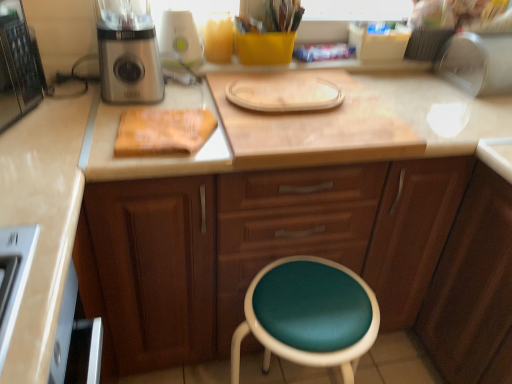
The image size is (512, 384). Describe the element at coordinates (309, 315) in the screenshot. I see `teal leather stool at lower center` at that location.

Where is `wooden cabinet at center`? This screenshot has height=384, width=512. wooden cabinet at center is located at coordinates (255, 248).

This screenshot has width=512, height=384. I want to click on white plastic blender at upper center, positioned as the 2th appliance in right-to-left order, so click(x=179, y=39).

What is the approximate width of satin silver blender at left?

It is 8.88 inches.

At what (x,y) coordinates should I click in order to perform the action: click on metallic silver appliance at upper right, the second appliance positioned from the left. Please return your answer as a coordinate pair (x, y). The image size is (512, 384). Looking at the image, I should click on (477, 63).

Where is `wooden cutting board at center`? Image resolution: width=512 pixels, height=384 pixels. wooden cutting board at center is located at coordinates (316, 130).

In order to click on teal leather stool at lower center in this screenshot , I will do `click(309, 315)`.

Is wooden cutting board at center next to teal leather stool at lower center?

No, wooden cutting board at center is not touching teal leather stool at lower center.

Considering the points (350, 107) and (234, 380), which point is behind, point (350, 107) or point (234, 380)?

The point (350, 107) is more distant.

Considering the positions of objects wooden cutting board at center and teal leather stool at lower center in the image provided, who is more to the right, wooden cutting board at center or teal leather stool at lower center?

wooden cutting board at center.

Between wooden cutting board at center and teal leather stool at lower center, which one has less height?

With less height is wooden cutting board at center.

Is teal leather stool at lower center bigger or smaller than white plastic blender at upper center, placed as the 1th appliance when sorted from left to right?

Considering their sizes, teal leather stool at lower center takes up more space than white plastic blender at upper center, placed as the 1th appliance when sorted from left to right.

Is teal leather stool at lower center situated inside white plastic blender at upper center, positioned as the 2th appliance in right-to-left order, or outside?

teal leather stool at lower center cannot be found inside white plastic blender at upper center, positioned as the 2th appliance in right-to-left order.

From a real-world perspective, is teal leather stool at lower center under white plastic blender at upper center, placed as the 1th appliance when sorted from left to right?

Yes, from a real-world perspective, teal leather stool at lower center is below white plastic blender at upper center, placed as the 1th appliance when sorted from left to right.

How different are the orientations of teal leather stool at lower center and white plastic blender at upper center, positioned as the 2th appliance in right-to-left order, in degrees?

teal leather stool at lower center and white plastic blender at upper center, positioned as the 2th appliance in right-to-left order, are facing 0.0428 degrees away from each other.

Considering the sizes of satin silver blender at left and wooden cutting board at center in the image, is satin silver blender at left wider or thinner than wooden cutting board at center?

Considering their sizes, satin silver blender at left looks slimmer than wooden cutting board at center.

Can you confirm if satin silver blender at left is shorter than wooden cutting board at center?

No, satin silver blender at left is not shorter than wooden cutting board at center.

Can wooden cutting board at center be found inside satin silver blender at left?

No, satin silver blender at left does not contain wooden cutting board at center.

Considering the relative sizes of wooden cabinet at center and teal leather stool at lower center in the image provided, is wooden cabinet at center taller than teal leather stool at lower center?

Yes.

In the scene shown: From the image's perspective, which one is positioned higher, wooden cabinet at center or teal leather stool at lower center?

From the image's view, wooden cabinet at center is above.

Does wooden cabinet at center have a greater width compared to teal leather stool at lower center?

Yes.

Considering the positions of objects wooden cabinet at center and teal leather stool at lower center in the image provided, who is behind, wooden cabinet at center or teal leather stool at lower center?

wooden cabinet at center.

Is white plastic blender at upper center, placed as the 1th appliance when sorted from left to right, at the left side of wooden cabinet at center?

Yes, white plastic blender at upper center, placed as the 1th appliance when sorted from left to right, is to the left of wooden cabinet at center.

Which is less distant, (x=189, y=22) or (x=407, y=268)?

Point (x=189, y=22)

Is white plastic blender at upper center, placed as the 1th appliance when sorted from left to right, looking in the opposite direction of wooden cabinet at center?

white plastic blender at upper center, placed as the 1th appliance when sorted from left to right, is not turned away from wooden cabinet at center.

Is white plastic blender at upper center, placed as the 1th appliance when sorted from left to right, thinner than wooden cabinet at center?

Yes.

Can you confirm if metallic silver appliance at upper right, the second appliance positioned from the left, is shorter than satin silver blender at left?

Correct, metallic silver appliance at upper right, the second appliance positioned from the left, is not as tall as satin silver blender at left.

Which of these two, metallic silver appliance at upper right, the second appliance positioned from the left, or satin silver blender at left, is thinner?

Thinner between the two is metallic silver appliance at upper right, the second appliance positioned from the left.

Considering the sizes of metallic silver appliance at upper right, the second appliance positioned from the left, and satin silver blender at left in the image, is metallic silver appliance at upper right, the second appliance positioned from the left, bigger or smaller than satin silver blender at left?

Considering their sizes, metallic silver appliance at upper right, the second appliance positioned from the left, takes up less space than satin silver blender at left.

Are teal leather stool at lower center and wooden cabinet at center beside each other?

No, teal leather stool at lower center is not touching wooden cabinet at center.

Based on the photo, from a real-world perspective, does teal leather stool at lower center stand above wooden cabinet at center?

Incorrect, from a real-world perspective, teal leather stool at lower center is lower than wooden cabinet at center.

Is teal leather stool at lower center positioned with its back to wooden cabinet at center?

Yes, wooden cabinet at center is at the back of teal leather stool at lower center.

Considering the sizes of teal leather stool at lower center and wooden cabinet at center in the image, is teal leather stool at lower center taller or shorter than wooden cabinet at center?

Clearly, teal leather stool at lower center is shorter compared to wooden cabinet at center.

Where is `chair in front of the wooden cutting board at center`? The image size is (512, 384). chair in front of the wooden cutting board at center is located at coordinates (309, 315).

The image size is (512, 384). Find the location of `appliance that is the 2nd object located above the teal leather stool at lower center (from the image's perspective)`. appliance that is the 2nd object located above the teal leather stool at lower center (from the image's perspective) is located at coordinates (179, 39).

Which object lies nearer to the anchor point wooden cabinet at center, wooden cutting board at center or white plastic blender at upper center, placed as the 1th appliance when sorted from left to right?

The object closer to wooden cabinet at center is wooden cutting board at center.

When comparing their distances from satin silver blender at left, does white plastic blender at upper center, positioned as the 2th appliance in right-to-left order, or wooden cutting board at center seem closer?

white plastic blender at upper center, positioned as the 2th appliance in right-to-left order.

From the image, which object appears to be farther from satin silver blender at left, metallic silver appliance at upper right, the second appliance positioned from the left, or wooden cabinet at center?

metallic silver appliance at upper right, the second appliance positioned from the left, is further to satin silver blender at left.

Which object lies further to the anchor point teal leather stool at lower center, wooden cutting board at center or satin silver blender at left?

Based on the image, satin silver blender at left appears to be further to teal leather stool at lower center.

Estimate the real-world distances between objects in this image. Which object is closer to satin silver blender at left, metallic silver appliance at upper right, acting as the first appliance starting from the right, or teal leather stool at lower center?

Among the two, teal leather stool at lower center is located nearer to satin silver blender at left.

Considering their positions, is satin silver blender at left positioned closer to wooden cabinet at center than teal leather stool at lower center?

Based on the image, teal leather stool at lower center appears to be nearer to wooden cabinet at center.

When comparing their distances from teal leather stool at lower center, does wooden cabinet at center or satin silver blender at left seem closer?

wooden cabinet at center is positioned closer to the anchor teal leather stool at lower center.

From the image, which object appears to be farther from wooden cutting board at center, satin silver blender at left or teal leather stool at lower center?

Based on the image, satin silver blender at left appears to be further to wooden cutting board at center.

Locate an element on the screen. This screenshot has width=512, height=384. cabinetry located between satin silver blender at left and metallic silver appliance at upper right, acting as the first appliance starting from the right, in the left-right direction is located at coordinates (255, 248).

Find the location of a particular element. Image resolution: width=512 pixels, height=384 pixels. counter top between white plastic blender at upper center, positioned as the 2th appliance in right-to-left order, and teal leather stool at lower center vertically is located at coordinates 316,130.

You are a GUI agent. You are given a task and a screenshot of the screen. Output one action in this format:
    pyautogui.click(x=<x>, y=<y>)
    Task: Click on the kitchen appliance that lies between white plastic blender at upper center, positioned as the 2th appliance in right-to-left order, and teal leather stool at lower center from top to bottom
    This screenshot has height=384, width=512.
    Given the screenshot: What is the action you would take?
    pos(128,54)

You are a GUI agent. You are given a task and a screenshot of the screen. Output one action in this format:
    pyautogui.click(x=<x>, y=<y>)
    Task: Click on the counter top between white plastic blender at upper center, positioned as the 2th appliance in right-to-left order, and wooden cabinet at center vertically
    
    Given the screenshot: What is the action you would take?
    pyautogui.click(x=316, y=130)